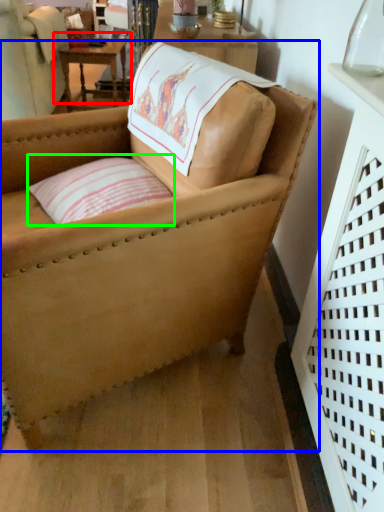
Question: Which object is the closest to the table (highlighted by a red box)? Choose among these: chair (highlighted by a blue box) or pillow (highlighted by a green box).

Choices:
 (A) chair
 (B) pillow

Answer: (B)